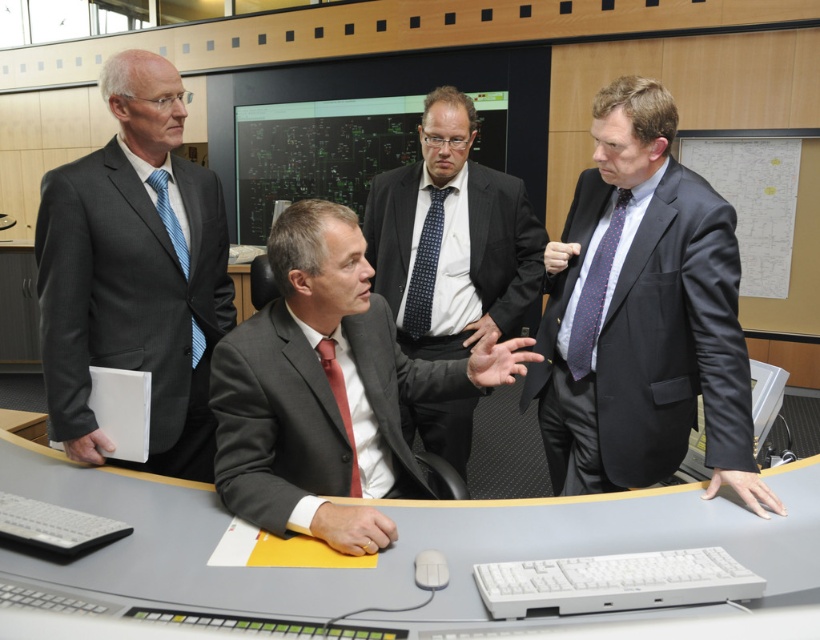
Looking at this image, based on the scene, which object, the dark gray suit at right or the black glossy monitor at center, is positioned to the right side of the other?

The dark gray suit at right is positioned to the right of the black glossy monitor at center.

You are an observer in the control room. You need to locate the dark gray suit at left. Where exactly is it positioned in the scene?

The dark gray suit at left is positioned at coordinates point (134, 273).